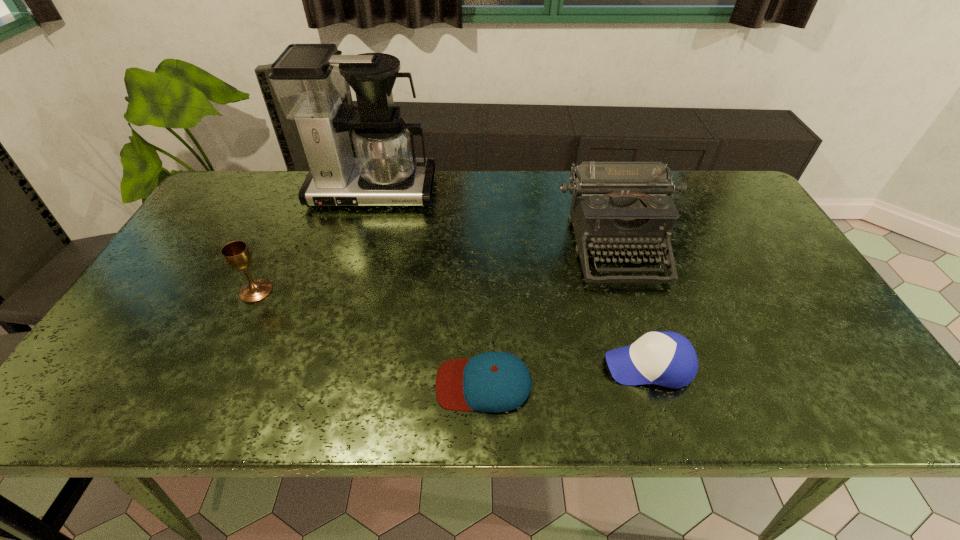
The image size is (960, 540). What are the coordinates of `free spot between the fourth tallest object and the chalice` in the screenshot? It's located at (452, 328).

The image size is (960, 540). Find the location of `vacant space that's between the chalice and the taller baseball cap`. vacant space that's between the chalice and the taller baseball cap is located at coordinates (452, 328).

You are a GUI agent. You are given a task and a screenshot of the screen. Output one action in this format:
    pyautogui.click(x=<x>, y=<y>)
    Task: Click on the vacant space in between the right baseball cap and the shortest object
    The image size is (960, 540).
    Given the screenshot: What is the action you would take?
    pyautogui.click(x=566, y=375)

Locate an element on the screen. vacant point located between the shortest object and the third shortest object is located at coordinates (370, 338).

Identify which object is the fourth nearest to the taller baseball cap. Please provide its 2D coordinates. Your answer should be formatted as a tuple, i.e. [(x, y)], where the tuple contains the x and y coordinates of a point satisfying the conditions above.

[(237, 255)]

You are a GUI agent. You are given a task and a screenshot of the screen. Output one action in this format:
    pyautogui.click(x=<x>, y=<y>)
    Task: Click on the fourth closest object to the shorter baseball cap
    Image resolution: width=960 pixels, height=540 pixels.
    Given the screenshot: What is the action you would take?
    pyautogui.click(x=309, y=81)